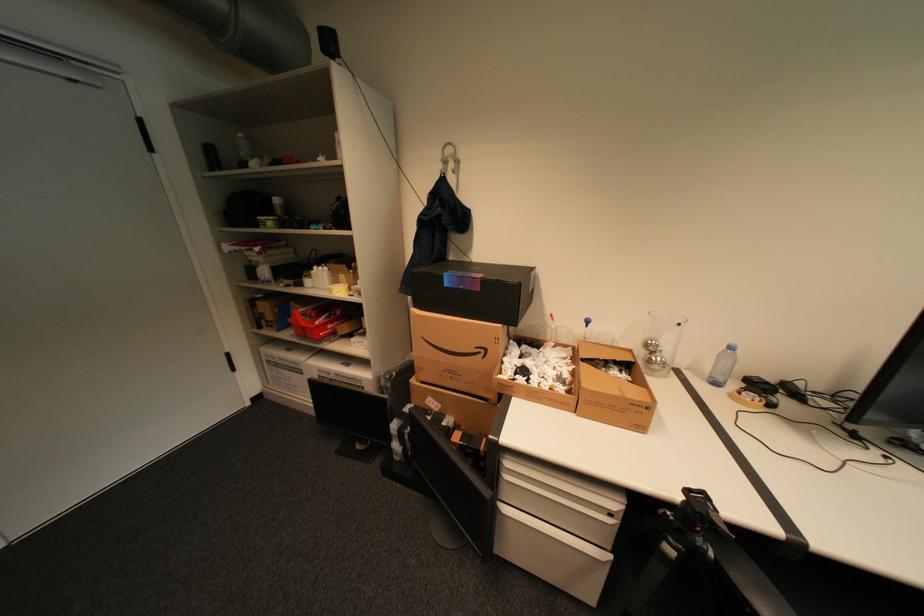
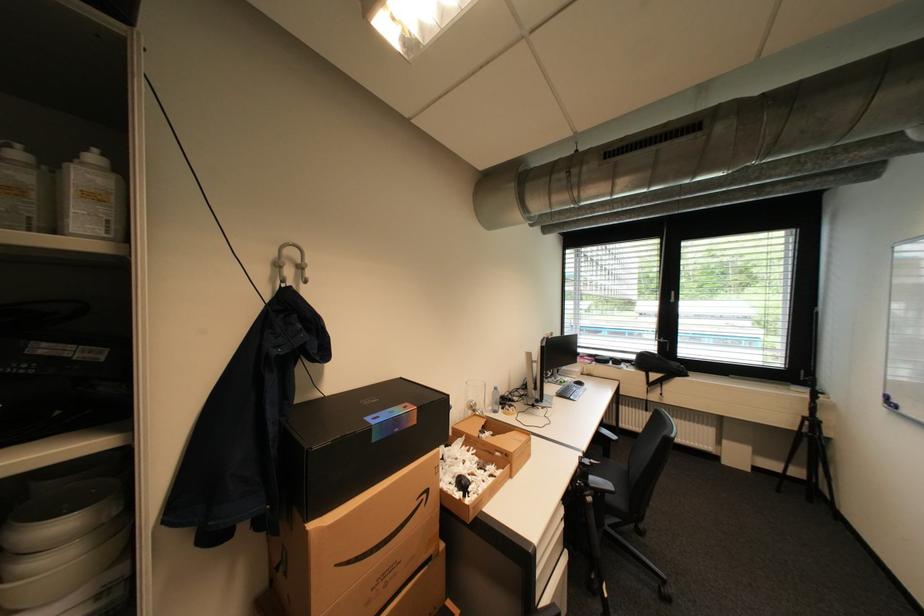
Where in the second image is the point corresponding to the point at 446,204 from the first image?

(309, 326)